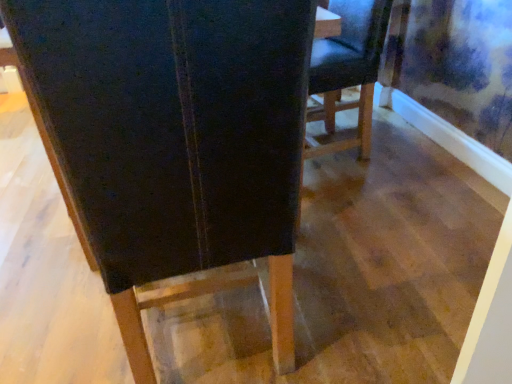
Where is `vacant space to the right of matte black chair at center, the first chair viewed from the right`? vacant space to the right of matte black chair at center, the first chair viewed from the right is located at coordinates (407, 145).